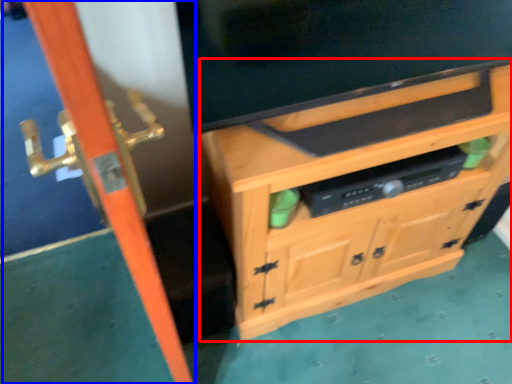
Question: Which object is closer to the camera taking this photo, cabinetry (highlighted by a red box) or screen door (highlighted by a blue box)?

Choices:
 (A) cabinetry
 (B) screen door

Answer: (B)